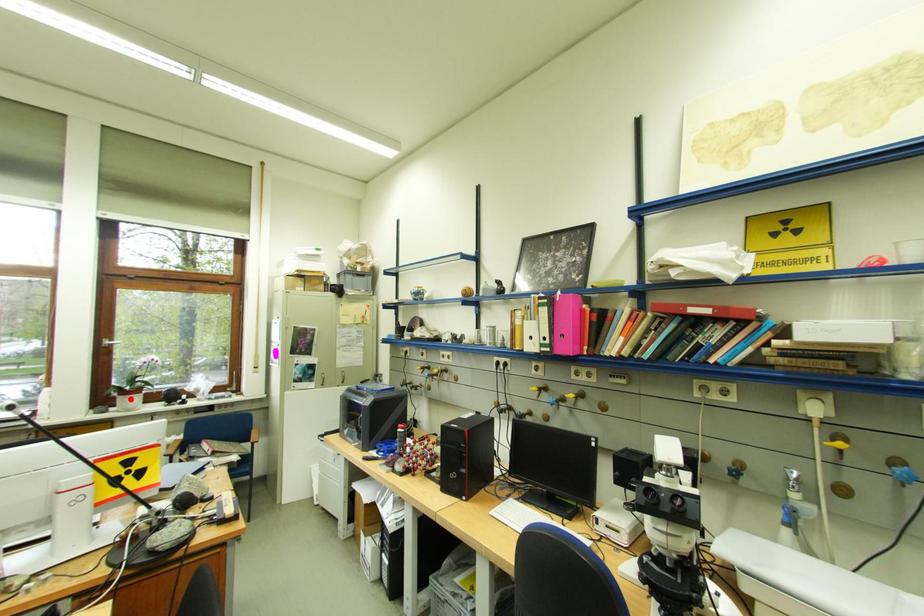
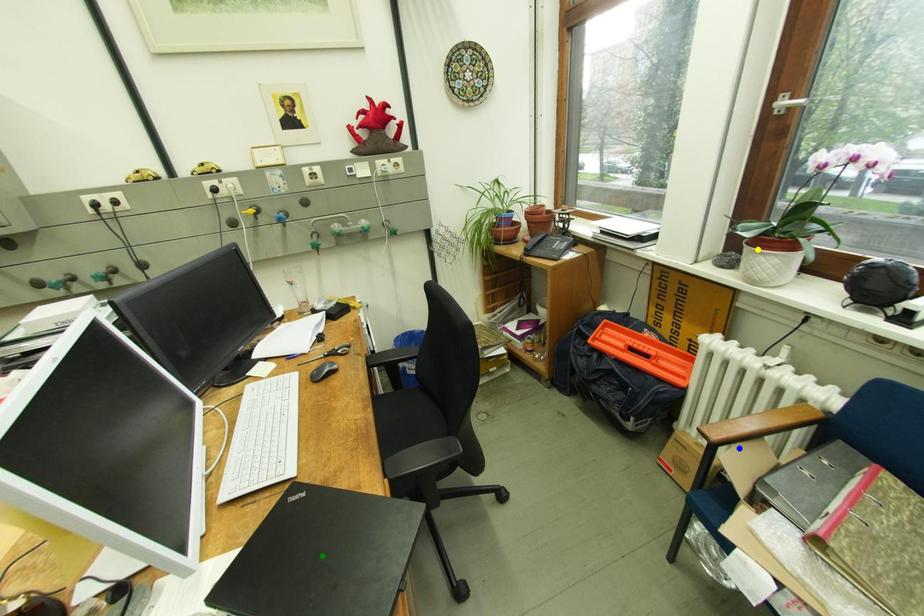
Question: I am providing you with two images of the same scene from different viewpoints. A red point is marked on the first image. You are given multiple points on the second image. Which point in image 2 is actually the same real-world point as the red point in image 1?

Choices:
 (A) green point
 (B) blue point
 (C) yellow point

Answer: (C)